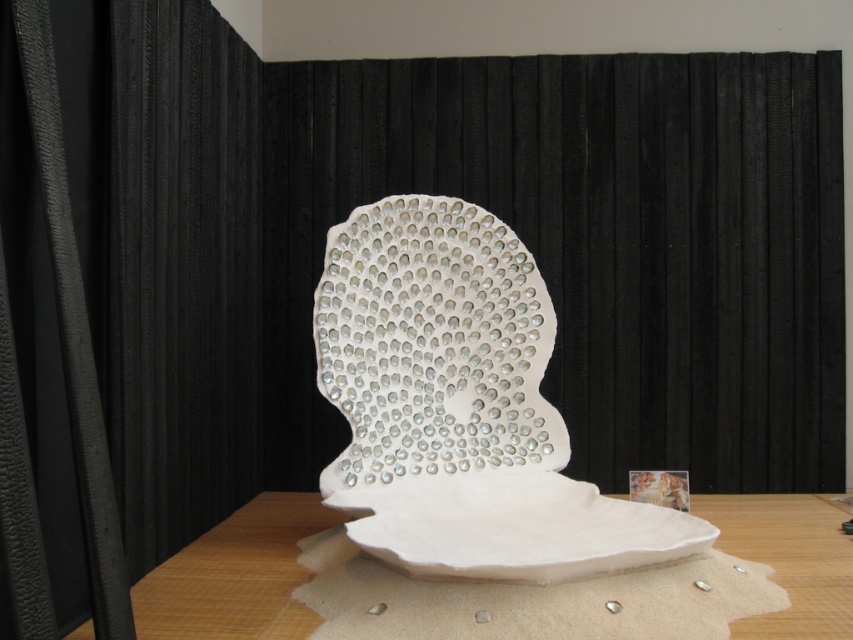
Is white matte table at center in front of matte white painting at center?

Yes, white matte table at center is in front of matte white painting at center.

Can you confirm if white matte table at center is smaller than matte white painting at center?

No.

What do you see at coordinates (236, 576) in the screenshot? I see `white matte table at center` at bounding box center [236, 576].

Locate an element on the screen. The image size is (853, 640). white matte table at center is located at coordinates (236, 576).

Is the position of white glossy shell at center less distant than that of matte white painting at center?

Yes, white glossy shell at center is in front of matte white painting at center.

The image size is (853, 640). I want to click on white glossy shell at center, so click(460, 406).

Can you confirm if white glossy shell at center is thinner than white matte table at center?

No, white glossy shell at center is not thinner than white matte table at center.

Can you confirm if white glossy shell at center is bigger than white matte table at center?

Indeed, white glossy shell at center has a larger size compared to white matte table at center.

Is point (351, 280) closer to viewer compared to point (234, 525)?

That is True.

Image resolution: width=853 pixels, height=640 pixels. I want to click on white glossy shell at center, so click(460, 406).